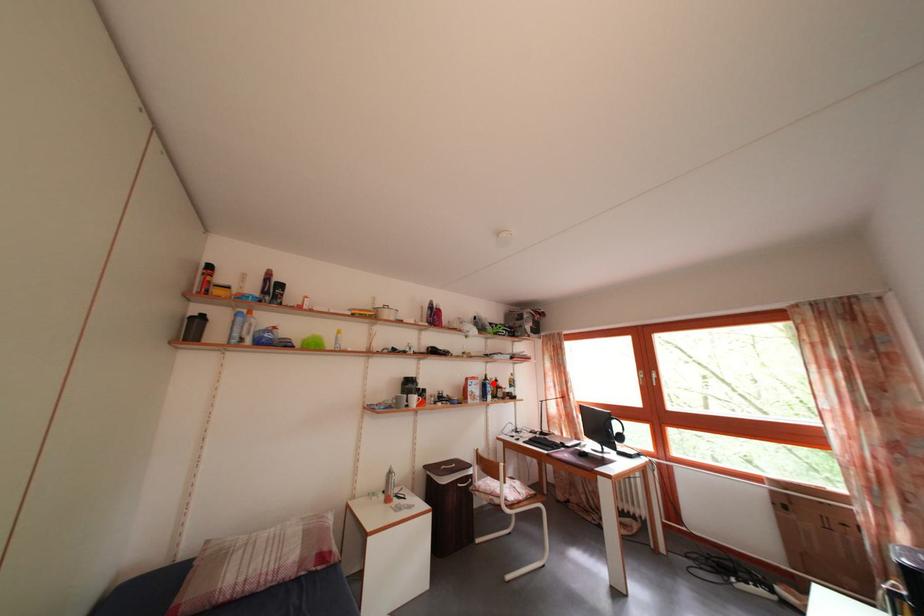
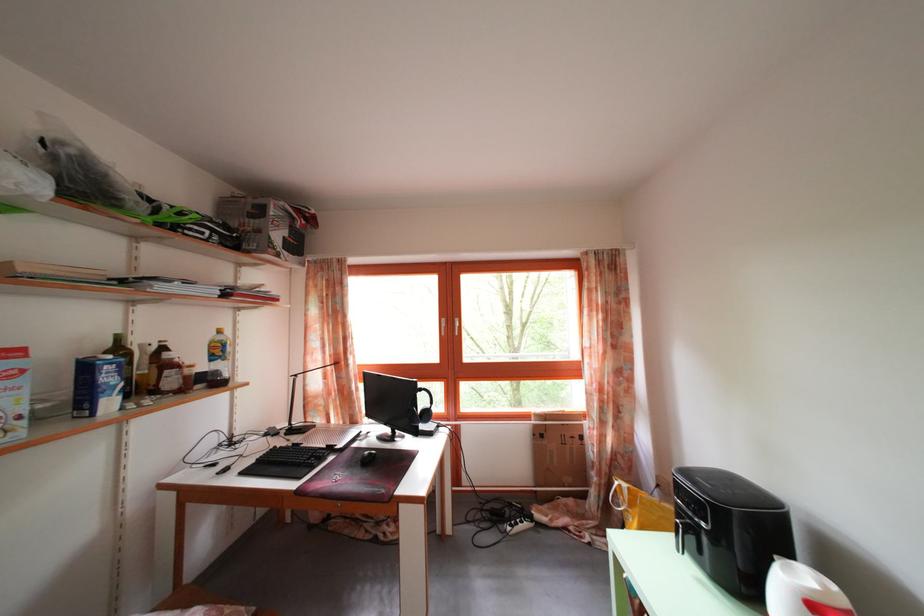
The point at the highlighted location is marked in the first image. Where is the corresponding point in the second image?

(126, 346)